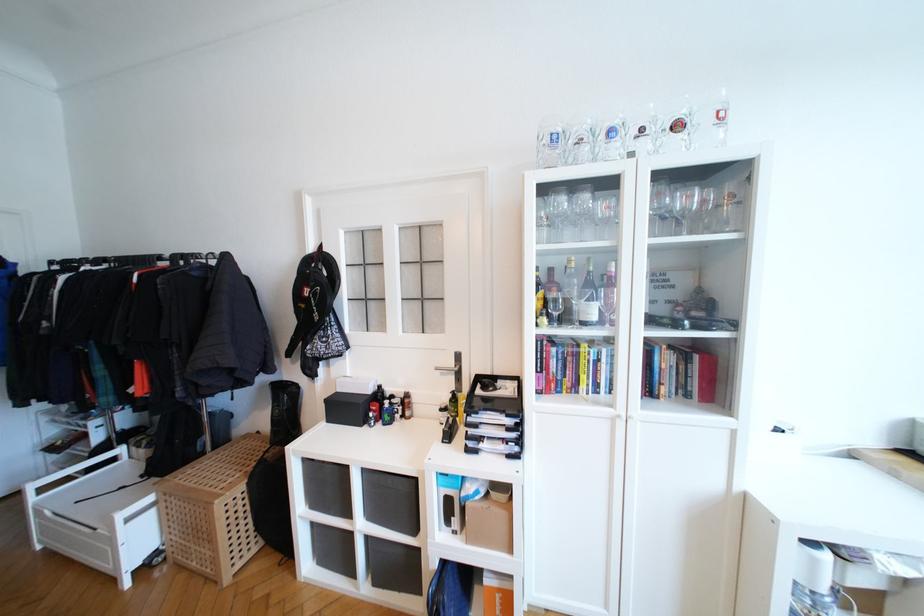
Where would you pour the green wine bottle? Please return your answer as a coordinate pair (x, y).

(588, 298)